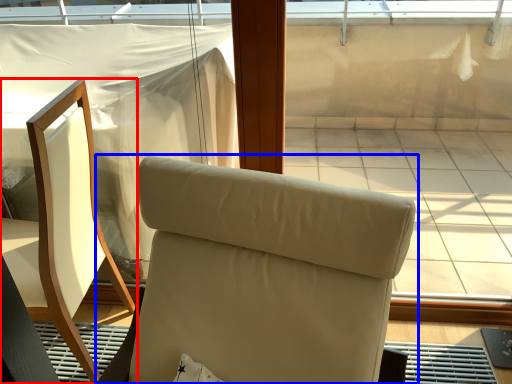
Question: Which point is closer to the camera, chair (highlighted by a red box) or chair (highlighted by a blue box)?

Choices:
 (A) chair
 (B) chair

Answer: (B)